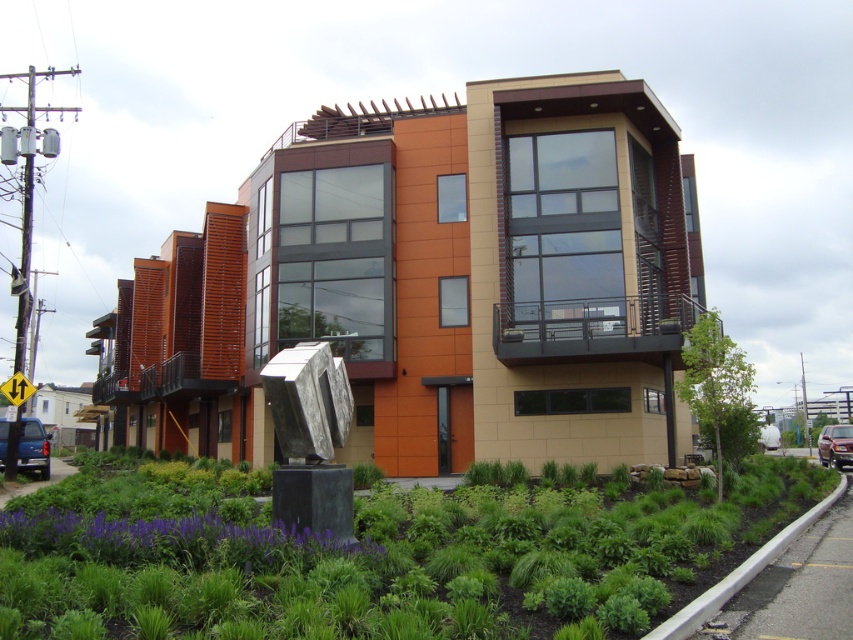
Question: In this image, where is green leafy plant at center located relative to white concrete curb at lower right?

Choices:
 (A) right
 (B) left

Answer: (B)

Question: Can you confirm if green leafy plant at center is positioned to the left of shiny black sedan at lower right?

Choices:
 (A) no
 (B) yes

Answer: (B)

Question: Which object is positioned closest to the shiny black sedan at lower right?

Choices:
 (A) white concrete curb at lower right
 (B) matte blue truck at lower left

Answer: (A)

Question: Which object appears farthest from the camera in this image?

Choices:
 (A) matte blue truck at lower left
 (B) green leafy plant at center

Answer: (A)

Question: Can you confirm if green leafy plant at center is positioned to the right of white concrete curb at lower right?

Choices:
 (A) no
 (B) yes

Answer: (A)

Question: Among these points, which one is nearest to the camera?

Choices:
 (A) (640, 506)
 (B) (30, 442)
 (C) (747, 573)

Answer: (C)